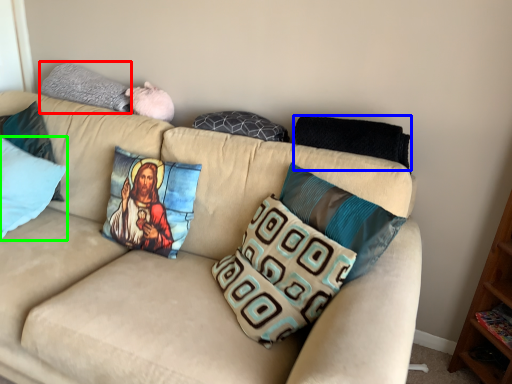
Question: Which is nearer to the pillow (highlighted by a red box)? pillow (highlighted by a blue box) or pillow (highlighted by a green box).

Choices:
 (A) pillow
 (B) pillow

Answer: (B)